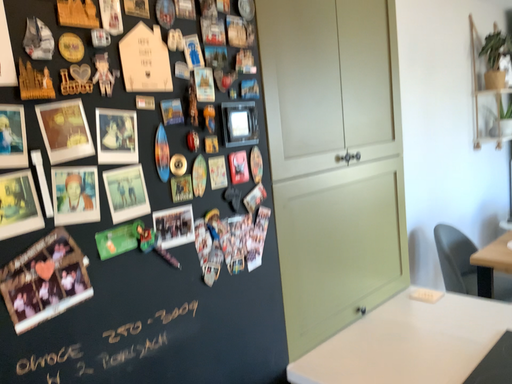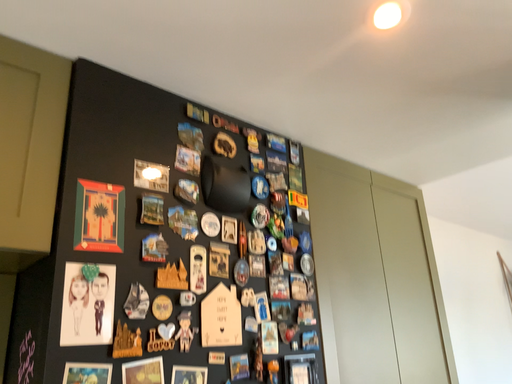
Question: How did the camera likely rotate when shooting the video?

Choices:
 (A) rotated downward
 (B) rotated upward

Answer: (B)